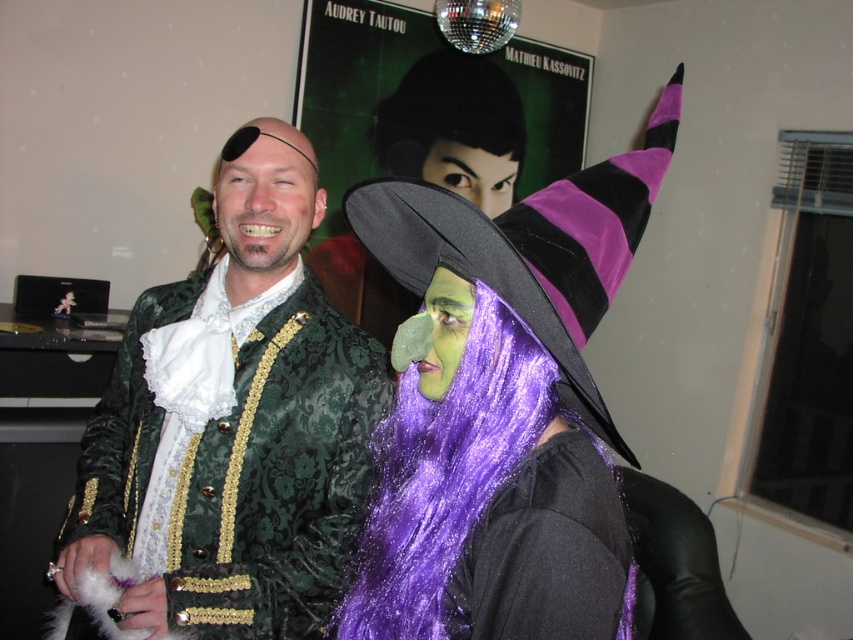
You are a costume designer looking at the two characters in the image. The green velvet jacket at center belongs to the person on the left, and the black shiny hair at upper center belongs to the witch on the right. Which costume element is higher in the image?

The green velvet jacket at center is taller than the black shiny hair at upper center, so the green velvet jacket at center is higher in the image.

You are a photographer at a costume party. You need to position the purple satin witch hat at upper right and the purple glittery wig at center so that they are both visible in the frame. Based on their current positions, which object is closer to the right edge of the photo?

The purple satin witch hat at upper right is closer to the right edge of the photo because it is positioned to the right of the purple glittery wig at center.

You are a photographer at a costume party. You need to position the shiny green velvet jacket at left and the purple satin witch hat at upper right in your frame. Which object should you focus on first if you want to capture both in a single shot, considering their sizes?

The shiny green velvet jacket at left is much taller than the purple satin witch hat at upper right, so you should focus on the shiny green velvet jacket at left first to ensure it fits within the frame.